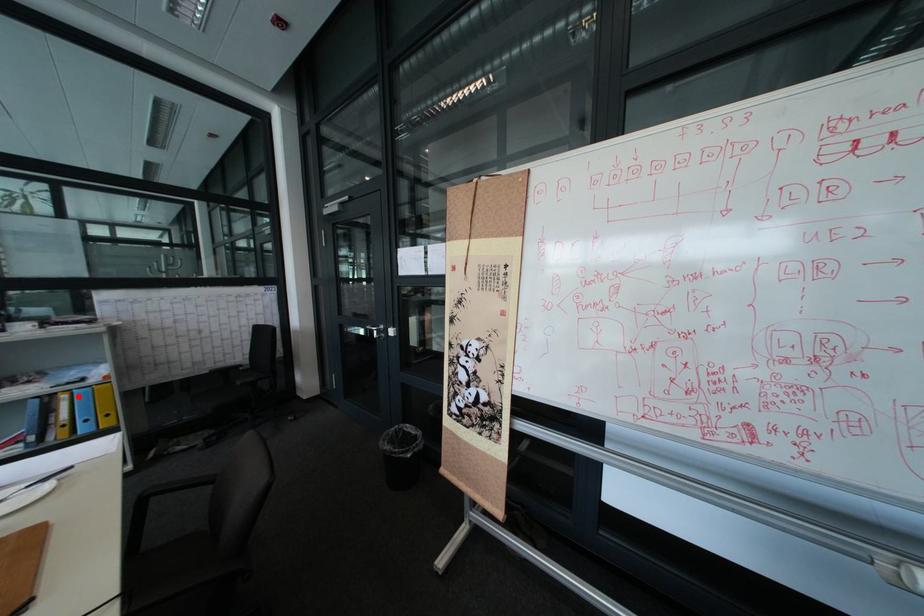
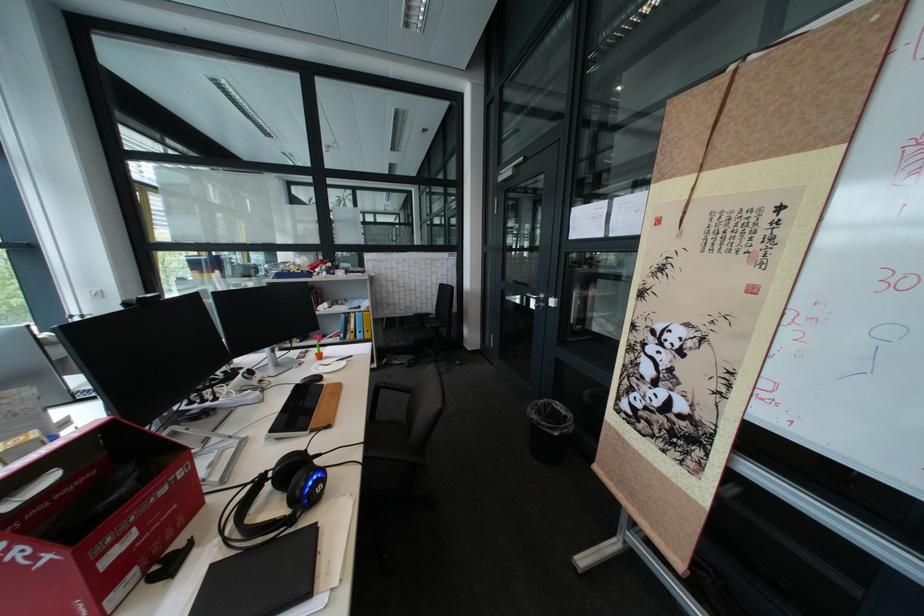
Question: I am providing you with two images of the same scene from different viewpoints. In image1, a red point is highlighted. Considering the same 3D point in image2, which of the following is correct?

Choices:
 (A) It is closer
 (B) It is farther

Answer: (A)